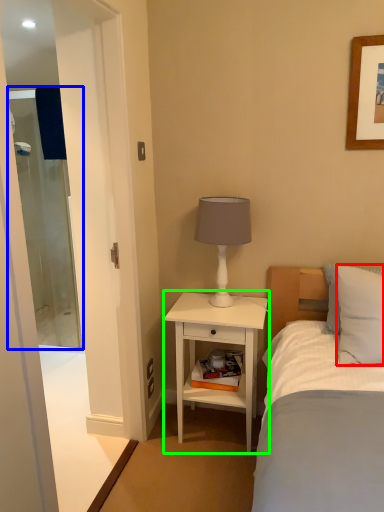
Question: Which is farther away from pillow (highlighted by a red box)? screen door (highlighted by a blue box) or nightstand (highlighted by a green box)?

Choices:
 (A) screen door
 (B) nightstand

Answer: (A)